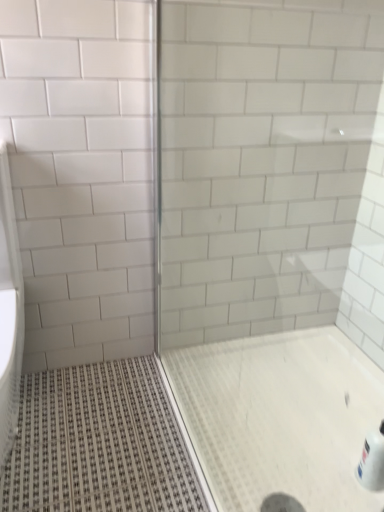
Question: Is transparent glass screen door at center situated inside white glossy bottle at lower right or outside?

Choices:
 (A) outside
 (B) inside

Answer: (A)

Question: Is point (263, 398) positioned closer to the camera than point (370, 477)?

Choices:
 (A) closer
 (B) farther

Answer: (B)

Question: Relative to white glossy bottle at lower right, is transparent glass screen door at center in front or behind?

Choices:
 (A) behind
 (B) front

Answer: (B)

Question: From the image's perspective, relative to transparent glass screen door at center, is white glossy bottle at lower right above or below?

Choices:
 (A) above
 (B) below

Answer: (B)

Question: Is white glossy bottle at lower right bigger or smaller than transparent glass screen door at center?

Choices:
 (A) small
 (B) big

Answer: (A)

Question: From a real-world perspective, is white glossy bottle at lower right above or below transparent glass screen door at center?

Choices:
 (A) above
 (B) below

Answer: (B)

Question: Considering the relative positions of white glossy bottle at lower right and transparent glass screen door at center in the image provided, is white glossy bottle at lower right to the left or to the right of transparent glass screen door at center?

Choices:
 (A) right
 (B) left

Answer: (A)